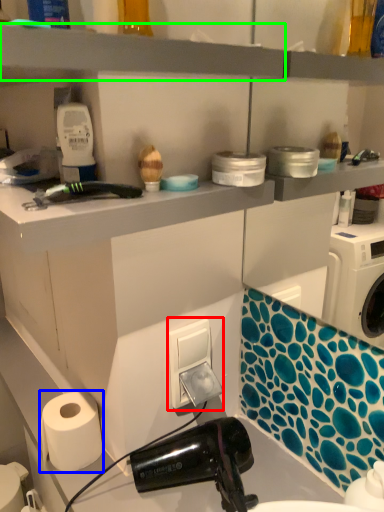
Question: Based on their relative distances, which object is farther from electric outlet (highlighted by a red box)? Choose from paper towel (highlighted by a blue box) and shelf (highlighted by a green box).

Choices:
 (A) paper towel
 (B) shelf

Answer: (B)